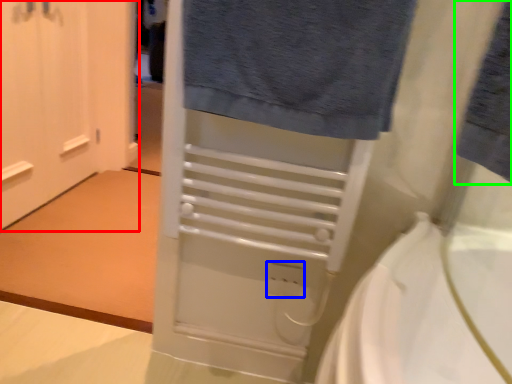
Question: Based on their relative distances, which object is farther from door (highlighted by a red box)? Choose from electric outlet (highlighted by a blue box) and bath towel (highlighted by a green box).

Choices:
 (A) electric outlet
 (B) bath towel

Answer: (B)